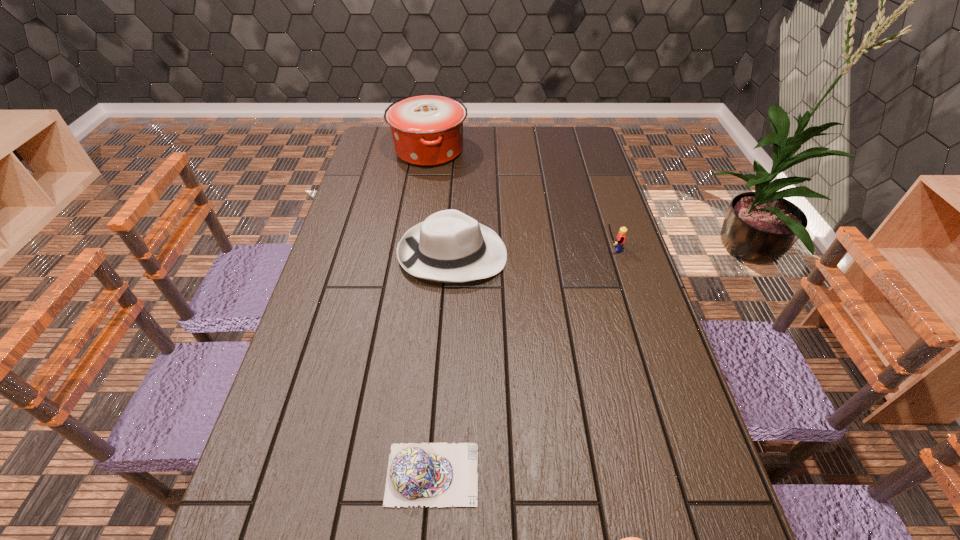
The height and width of the screenshot is (540, 960). Find the location of `free space located on the front, side, and top of the cap`. free space located on the front, side, and top of the cap is located at coordinates (638, 474).

The width and height of the screenshot is (960, 540). Identify the location of object present at the far edge. coord(427,130).

Locate an element on the screen. object positioned at the left edge is located at coordinates (427, 130).

Locate an element on the screen. This screenshot has height=540, width=960. object that is at the right edge is located at coordinates (618, 244).

Find the location of a particular element. This screenshot has width=960, height=540. object that is positioned at the far left corner is located at coordinates coord(427,130).

Locate an element on the screen. Image resolution: width=960 pixels, height=540 pixels. free region at the far edge of the desktop is located at coordinates (497, 146).

In order to click on free space at the left edge in this screenshot , I will do coord(366,239).

You are a GUI agent. You are given a task and a screenshot of the screen. Output one action in this format:
    pyautogui.click(x=<x>, y=<y>)
    Task: Click on the free space at the right edge
    Image resolution: width=960 pixels, height=540 pixels.
    Given the screenshot: What is the action you would take?
    [x=600, y=164]

What are the coordinates of `free space between the Lego and the tallest object` in the screenshot? It's located at (520, 200).

Where is `blank region between the fedora and the fourth farthest object`? The image size is (960, 540). blank region between the fedora and the fourth farthest object is located at coordinates (443, 364).